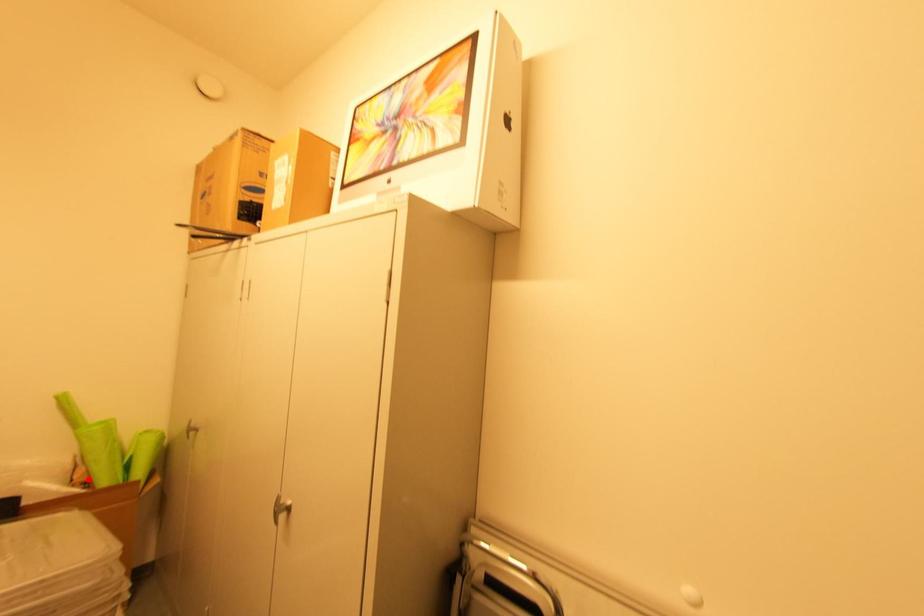
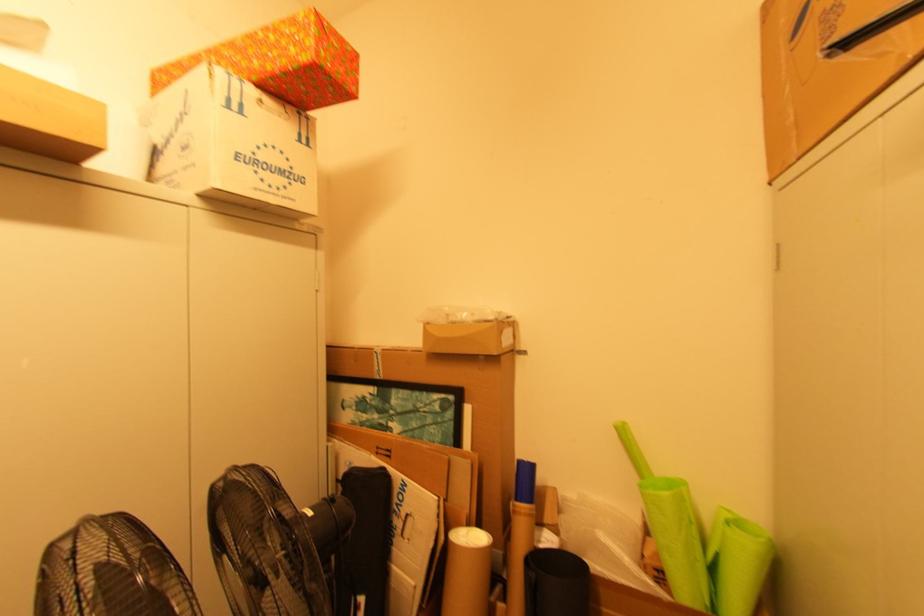
The point at the highlighted location is marked in the first image. Where is the corresponding point in the second image?

(659, 565)